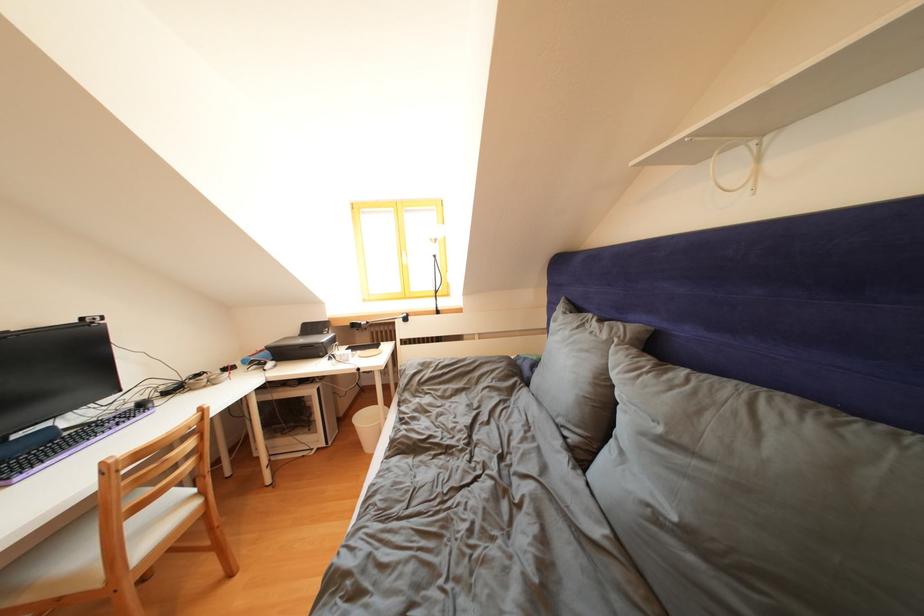
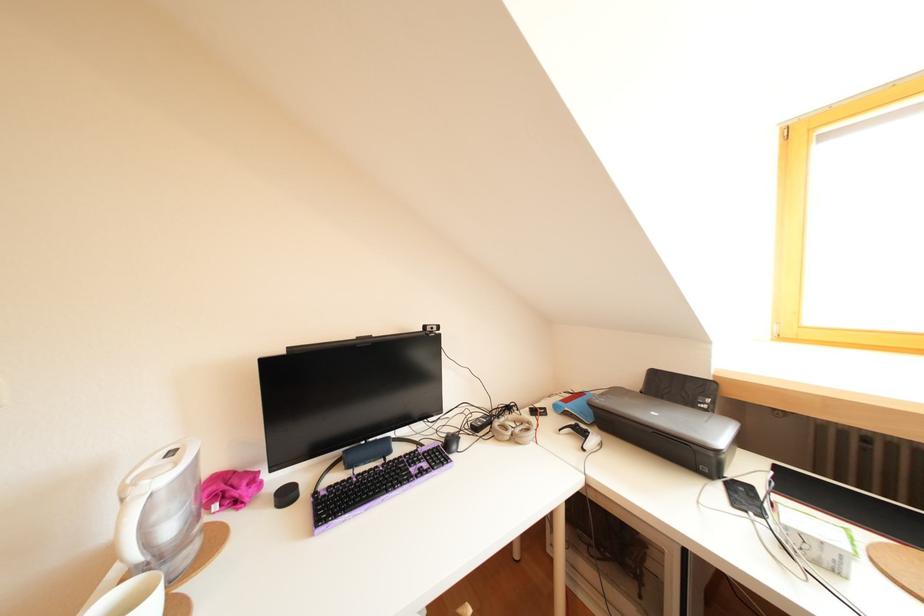
Where in the second image is the point corresponding to (205,381) from the first image?

(516, 413)